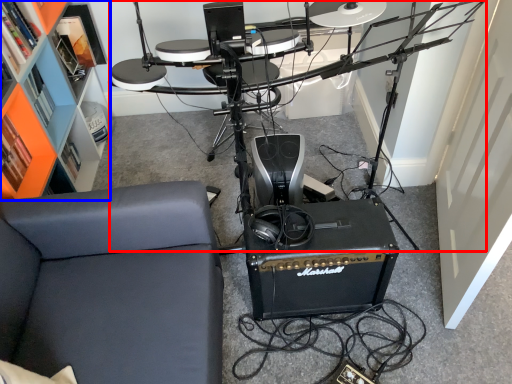
Question: Which of the following is the farthest to the observer, computer desk (highlighted by a red box) or bookshelf (highlighted by a blue box)?

Choices:
 (A) computer desk
 (B) bookshelf

Answer: (B)